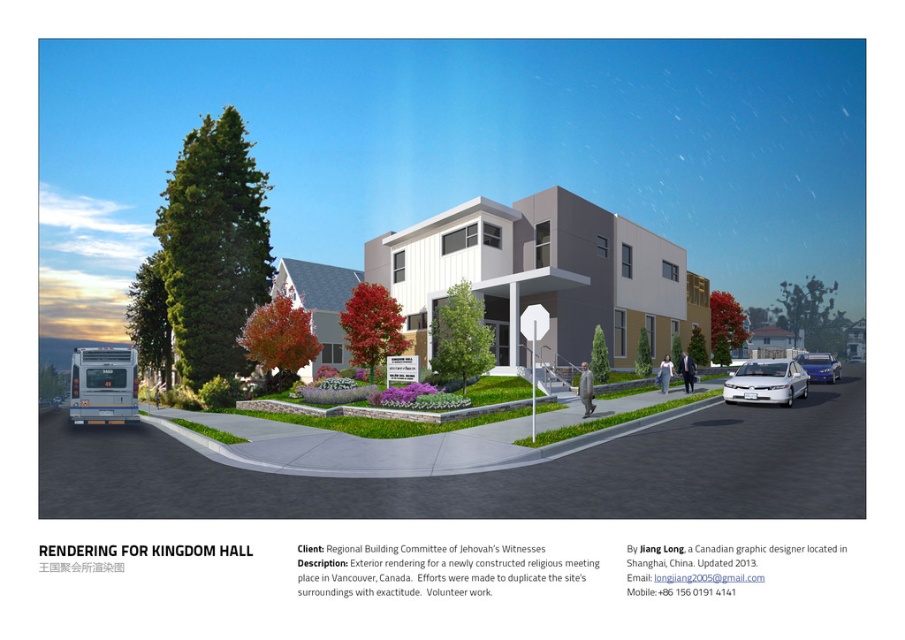
You are a delivery person who needs to park a large truck that is 2.5 meters tall. You see the silver metallic bus at lower left and the white glossy sedan at right in the parking lot. Can the truck pass between these two vehicles without hitting the roof?

The silver metallic bus at lower left is much taller than the white glossy sedan at right. Since the truck is 2.5 meters tall, it depends on the height of the bus. If the bus is taller than 2.5 meters, the truck cannot pass. However, if the bus is shorter, it might fit. But since the description only states the bus is taller than the sedan, we don